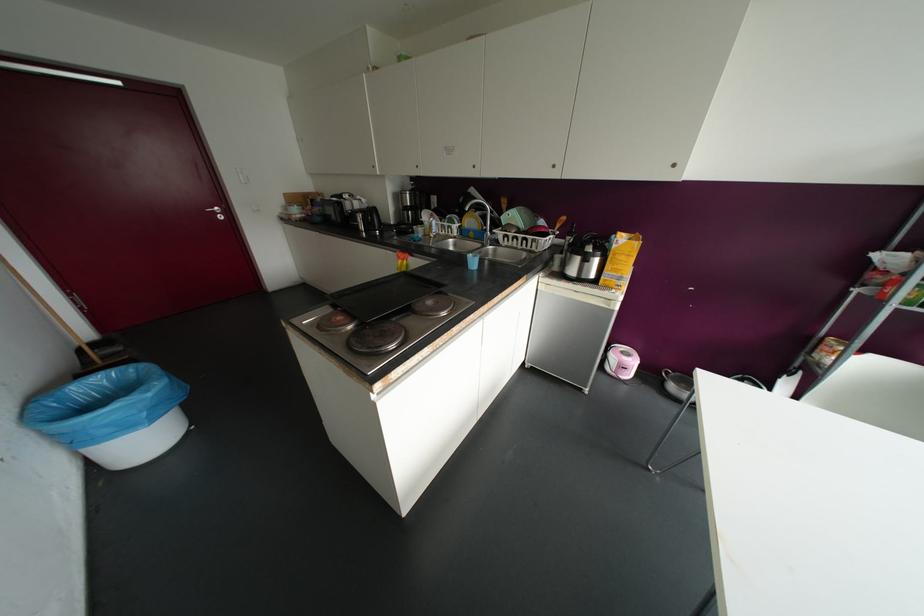
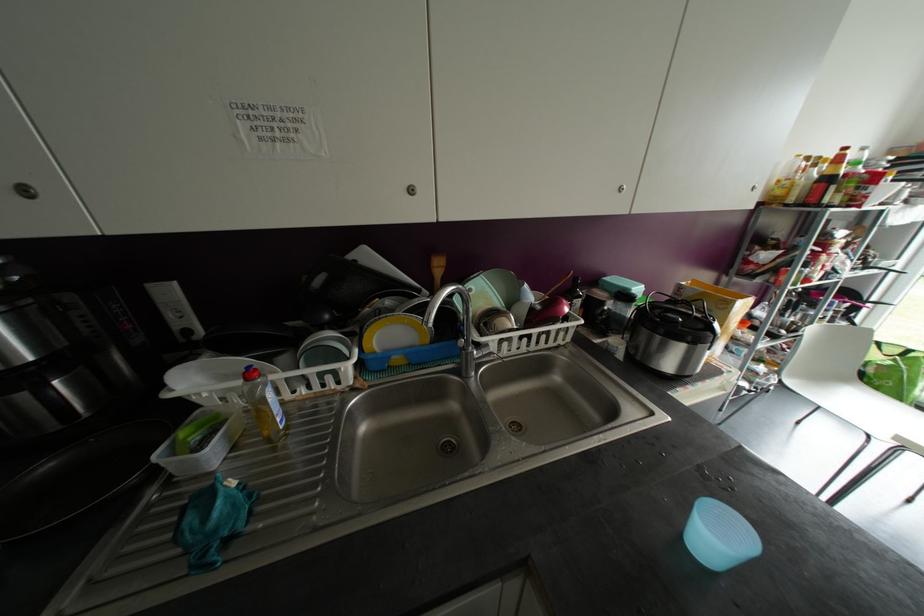
The point at (434,236) is marked in the first image. Where is the corresponding point in the second image?

(286, 427)